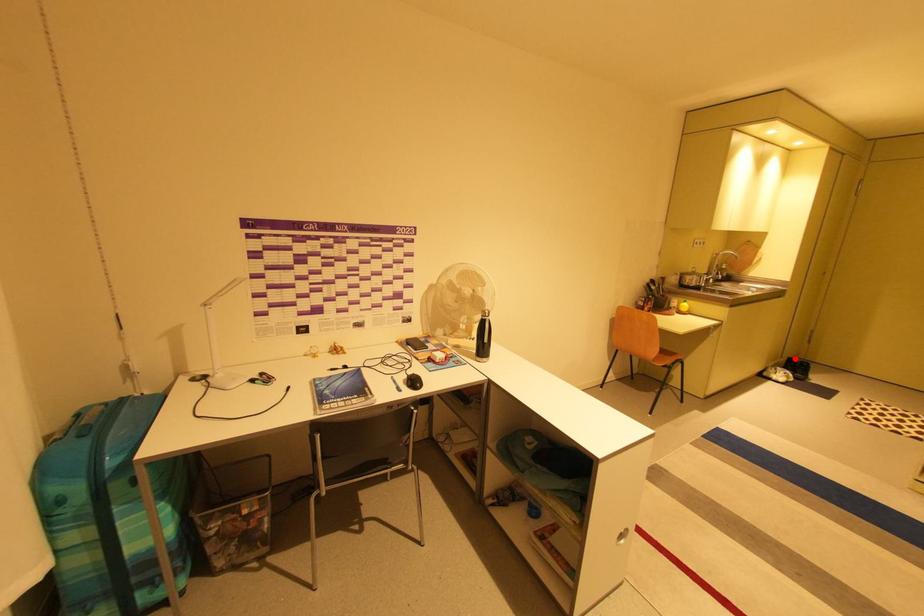
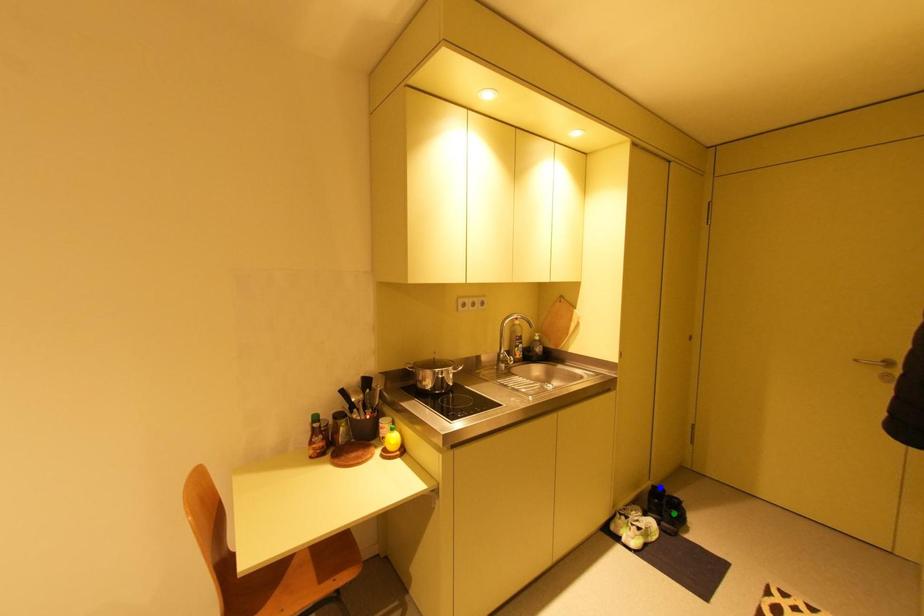
Question: I am providing you with two images of the same scene from different viewpoints. A red point is marked on the first image. You are given multiple points on the second image. Which mark in image 2 goes with the point in image 1?

Choices:
 (A) blue point
 (B) green point
 (C) yellow point

Answer: (A)